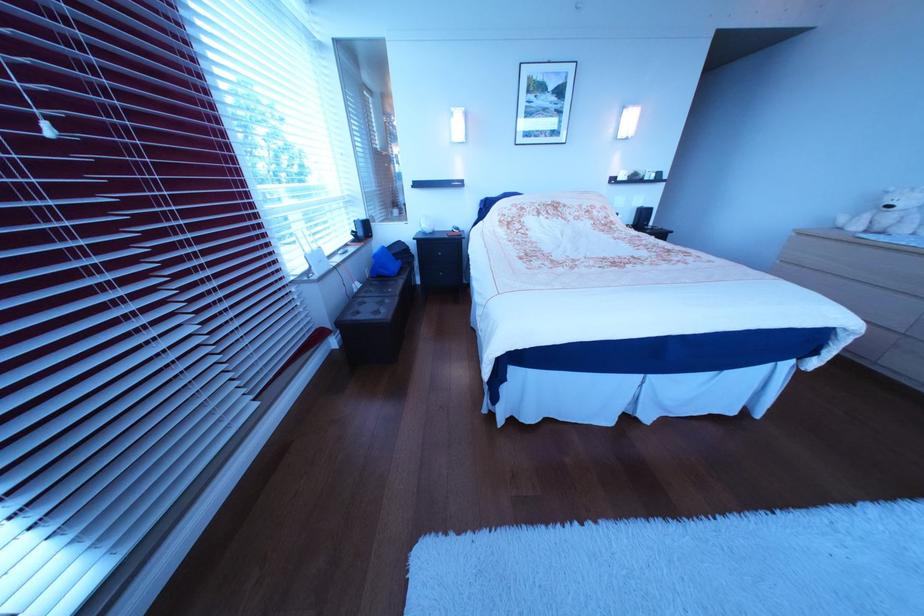
Where would you grasp the blue fabric bag? Please return your answer as a coordinate pair (x, y).

(383, 262)